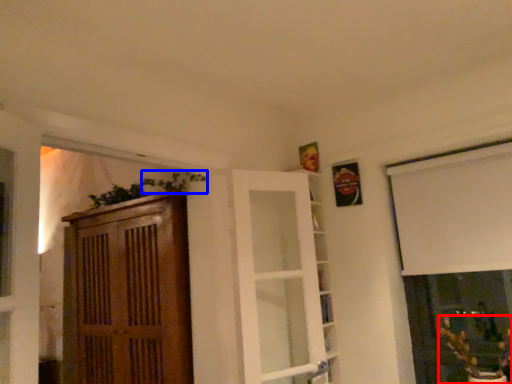
Question: Which point is closer to the camera, houseplant (highlighted by a red box) or plant (highlighted by a blue box)?

Choices:
 (A) houseplant
 (B) plant

Answer: (A)